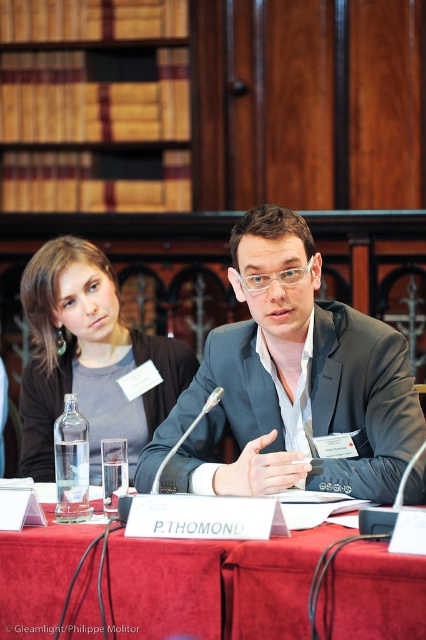
Where is `matte black suit at center`? The height and width of the screenshot is (640, 426). matte black suit at center is located at coordinates (290, 381).

Between matte black suit at center and brown leather book at upper left, which one appears on the right side from the viewer's perspective?

matte black suit at center is more to the right.

Which is behind, point (196, 372) or point (166, 157)?

Positioned behind is point (166, 157).

Identify the location of matte black suit at center. (290, 381).

Is matte black suit at center to the right of matte black hair at upper left from the viewer's perspective?

Indeed, matte black suit at center is positioned on the right side of matte black hair at upper left.

Identify the location of matte black suit at center. The width and height of the screenshot is (426, 640). pyautogui.click(x=290, y=381).

Which is behind, point (273, 401) or point (155, 572)?

The point (273, 401) is more distant.

This screenshot has width=426, height=640. What do you see at coordinates (290, 381) in the screenshot?
I see `matte black suit at center` at bounding box center [290, 381].

You are a GUI agent. You are given a task and a screenshot of the screen. Output one action in this format:
    pyautogui.click(x=<x>, y=<y>)
    Task: Click on the matte black suit at center
    Image resolution: width=426 pixels, height=640 pixels.
    Given the screenshot: What is the action you would take?
    pyautogui.click(x=290, y=381)